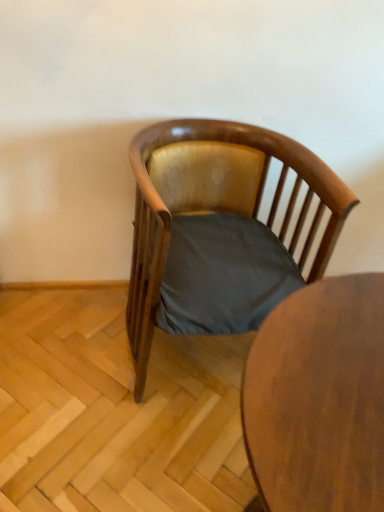
Image resolution: width=384 pixels, height=512 pixels. I want to click on wooden table at center, so click(319, 398).

Describe the element at coordinates (319, 398) in the screenshot. I see `wooden table at center` at that location.

Identify the location of wooden polished chair at center. (215, 201).

This screenshot has width=384, height=512. What do you see at coordinates (215, 201) in the screenshot?
I see `wooden polished chair at center` at bounding box center [215, 201].

Where is `wooden table at center`? The height and width of the screenshot is (512, 384). wooden table at center is located at coordinates (319, 398).

Would you say wooden table at center is to the left or to the right of wooden polished chair at center in the picture?

In the image, wooden table at center appears on the right side of wooden polished chair at center.

Which object is closer to the camera, wooden table at center or wooden polished chair at center?

wooden table at center is closer to the camera.

Which point is more distant from viewer, (281, 449) or (244, 208)?

Positioned behind is point (244, 208).

From the image's perspective, would you say wooden table at center is positioned over wooden polished chair at center?

No, from the image's perspective, wooden table at center is not over wooden polished chair at center.

From a real-world perspective, is wooden table at center physically located above or below wooden polished chair at center?

Clearly, from a real-world perspective, wooden table at center is below wooden polished chair at center.

Looking at their sizes, would you say wooden table at center is wider or thinner than wooden polished chair at center?

In the image, wooden table at center appears to be more narrow than wooden polished chair at center.

Considering the relative sizes of wooden table at center and wooden polished chair at center in the image provided, is wooden table at center taller than wooden polished chair at center?

Indeed, wooden table at center has a greater height compared to wooden polished chair at center.

Between wooden table at center and wooden polished chair at center, which one has larger size?

wooden polished chair at center.

From the picture: Is wooden polished chair at center completely or partially inside wooden table at center?

Actually, wooden polished chair at center is outside wooden table at center.

Is wooden table at center placed right next to wooden polished chair at center?

No, wooden table at center is not beside wooden polished chair at center.

Is wooden table at center oriented towards wooden polished chair at center?

No, wooden table at center is not turned towards wooden polished chair at center.

The height and width of the screenshot is (512, 384). I want to click on table below the wooden polished chair at center (from a real-world perspective), so click(x=319, y=398).

Which is more to the right, wooden polished chair at center or wooden table at center?

wooden table at center is more to the right.

Which object is further away from the camera, wooden polished chair at center or wooden table at center?

wooden polished chair at center is further away from the camera.

Is point (289, 248) positioned in front of point (357, 443)?

No, it is behind (357, 443).

From the image's perspective, is wooden polished chair at center over wooden table at center?

Yes, from the image's perspective, wooden polished chair at center is on top of wooden table at center.

From a real-world perspective, is wooden polished chair at center under wooden table at center?

Actually, wooden polished chair at center is physically above wooden table at center in the real world.

Does wooden polished chair at center have a lesser width compared to wooden table at center?

No.

Can you confirm if wooden polished chair at center is shorter than wooden table at center?

Yes, wooden polished chair at center is shorter than wooden table at center.

Considering the sizes of objects wooden polished chair at center and wooden table at center in the image provided, who is bigger, wooden polished chair at center or wooden table at center?

With larger size is wooden polished chair at center.

Is wooden polished chair at center inside the boundaries of wooden table at center, or outside?

wooden polished chair at center is outside wooden table at center.

Is there a large distance between wooden polished chair at center and wooden table at center?

wooden polished chair at center is near wooden table at center, not far away.

Is wooden polished chair at center facing towards wooden table at center?

Yes, wooden polished chair at center is facing wooden table at center.

What's the angular difference between wooden polished chair at center and wooden table at center's facing directions?

The angle between the facing direction of wooden polished chair at center and the facing direction of wooden table at center is 5.59 degrees.

Measure the distance from wooden polished chair at center to wooden table at center.

wooden polished chair at center and wooden table at center are 21.82 inches apart.

Where is `table to the right of wooden polished chair at center`? table to the right of wooden polished chair at center is located at coordinates click(x=319, y=398).

This screenshot has height=512, width=384. I want to click on table that appears on the right of wooden polished chair at center, so click(x=319, y=398).

The image size is (384, 512). Find the location of `chair above the wooden table at center (from a real-world perspective)`. chair above the wooden table at center (from a real-world perspective) is located at coordinates (215, 201).